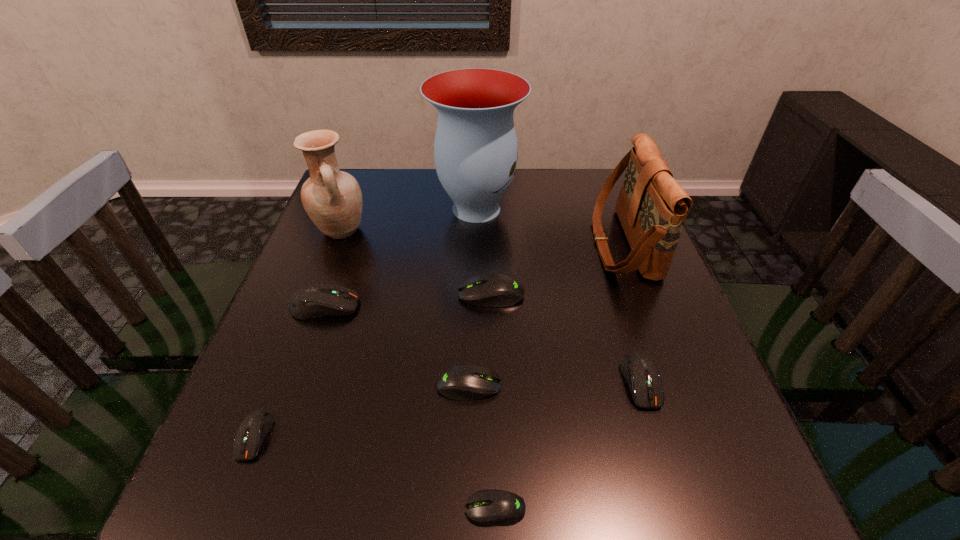
Locate an element on the screen. This screenshot has height=540, width=960. free point at the near right corner is located at coordinates (731, 516).

The height and width of the screenshot is (540, 960). What are the coordinates of `free space between the second farthest gray computer mouse and the shoulder bag` in the screenshot? It's located at (545, 314).

You are a GUI agent. You are given a task and a screenshot of the screen. Output one action in this format:
    pyautogui.click(x=<x>, y=<y>)
    Task: Click on the free space between the second farthest gray computer mouse and the shoulder bag
    
    Given the screenshot: What is the action you would take?
    pyautogui.click(x=545, y=314)

I want to click on vacant area that lies between the vase and the smallest dark computer equipment, so click(x=366, y=322).

Image resolution: width=960 pixels, height=540 pixels. I want to click on unoccupied position between the farthest gray computer mouse and the pink pottery, so click(416, 263).

You are a GUI agent. You are given a task and a screenshot of the screen. Output one action in this format:
    pyautogui.click(x=<x>, y=<y>)
    Task: Click on the free spot between the nearest gray computer mouse and the farthest gray computer mouse
    
    Given the screenshot: What is the action you would take?
    pyautogui.click(x=493, y=402)

Where is `vacant space that's between the shoulder bag and the nearest gray computer mouse`? The image size is (960, 540). vacant space that's between the shoulder bag and the nearest gray computer mouse is located at coordinates (x=559, y=376).

Where is `vacant space in between the nearest dark computer equipment and the second nearest gray computer mouse`? This screenshot has height=540, width=960. vacant space in between the nearest dark computer equipment and the second nearest gray computer mouse is located at coordinates (362, 411).

I want to click on vacant area that lies between the biggest gray computer mouse and the pottery, so click(x=416, y=263).

Where is `free space between the second biggest gray computer mouse and the nearest gray computer mouse`? The image size is (960, 540). free space between the second biggest gray computer mouse and the nearest gray computer mouse is located at coordinates (482, 447).